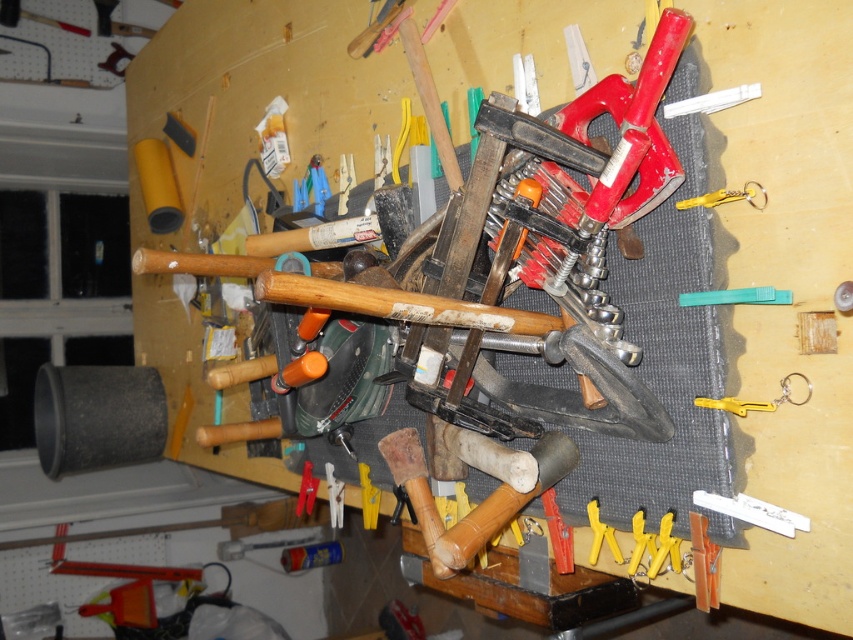
You are organizing the tools on the workbench and notice the yellow plastic clip at right and the yellow plastic keychain at upper right. Which one is closer to you as you stand in front of the workbench?

The yellow plastic clip at right is closer to you because it is in front of the yellow plastic keychain at upper right.

You are a carpenter who needs to reach the yellow plastic clothespin at lower center to secure a piece of wood. Considering your arm can extend 35 inches, can you reach it without moving any other objects?

The yellow plastic clothespin at lower center is 34.95 inches from the viewer, so yes, you can reach it with your arm extended to 35 inches since it is just slightly closer than your reach.